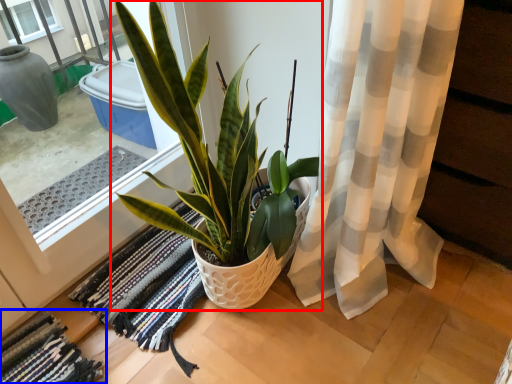
Question: Which object appears farthest to the camera in this image, houseplant (highlighted by a red box) or bath mat (highlighted by a blue box)?

Choices:
 (A) houseplant
 (B) bath mat

Answer: (B)